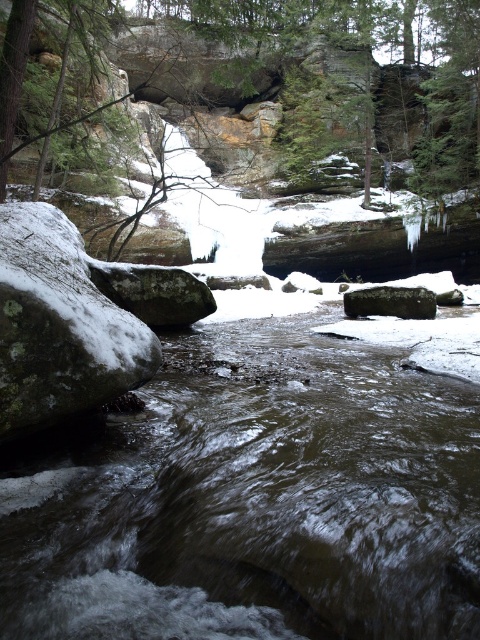
You are an artist sketching this winter scene. You want to ensure the green textured tree at upper center and the smooth gray rock at center are positioned correctly. Based on the scene description, which object should be drawn higher up in your sketch?

The green textured tree at upper center should be drawn higher up in the sketch because it is located above the smooth gray rock at center according to the description.